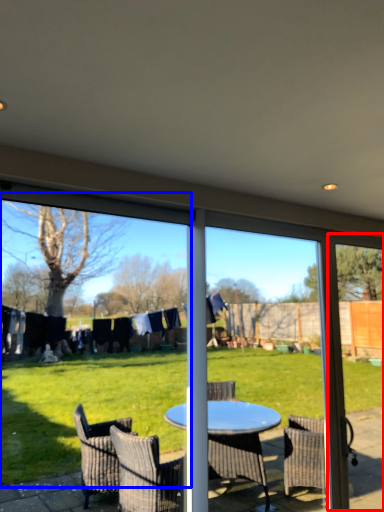
Question: Which of the following is the farthest to the observer, screen door (highlighted by a red box) or window screen (highlighted by a blue box)?

Choices:
 (A) screen door
 (B) window screen

Answer: (A)